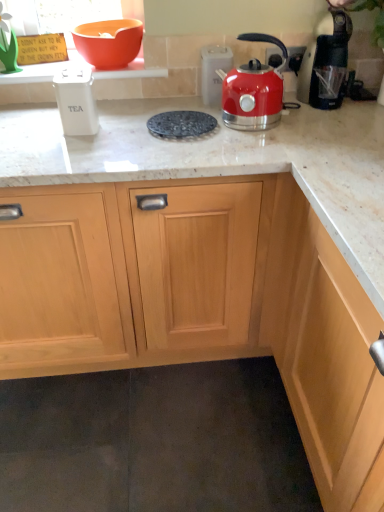
This screenshot has height=512, width=384. I want to click on vacant area on top of white marble countertop at center (from a real-world perspective), so click(x=177, y=131).